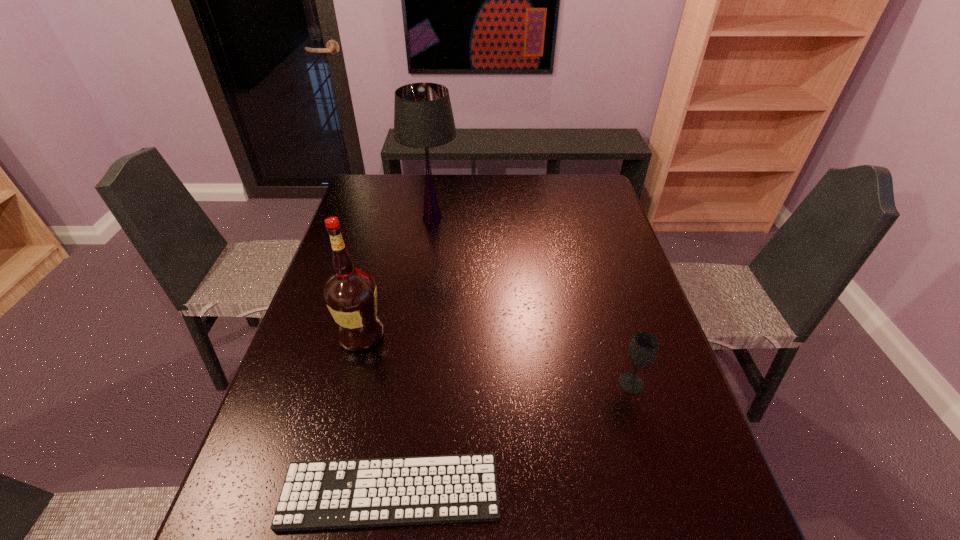
Where is `free space in the image that satisfies the following two spatial constraints: 1. on the front-facing side of the tallest object; 2. on the label of the alcohol`? The width and height of the screenshot is (960, 540). free space in the image that satisfies the following two spatial constraints: 1. on the front-facing side of the tallest object; 2. on the label of the alcohol is located at coordinates (416, 334).

At what (x,y) coordinates should I click in order to perform the action: click on vacant area that satisfies the following two spatial constraints: 1. on the back side of the nearest object; 2. on the label of the second tallest object. Please return your answer as a coordinate pair (x, y). Image resolution: width=960 pixels, height=540 pixels. Looking at the image, I should click on (414, 334).

Where is `free space in the image that satisfies the following two spatial constraints: 1. on the label of the alcohol; 2. on the back side of the shortest object`? This screenshot has width=960, height=540. free space in the image that satisfies the following two spatial constraints: 1. on the label of the alcohol; 2. on the back side of the shortest object is located at coordinates (321, 491).

This screenshot has height=540, width=960. Find the location of `free spot that satisfies the following two spatial constraints: 1. on the front-facing side of the farthest object; 2. on the label of the second farthest object`. free spot that satisfies the following two spatial constraints: 1. on the front-facing side of the farthest object; 2. on the label of the second farthest object is located at coordinates (416, 334).